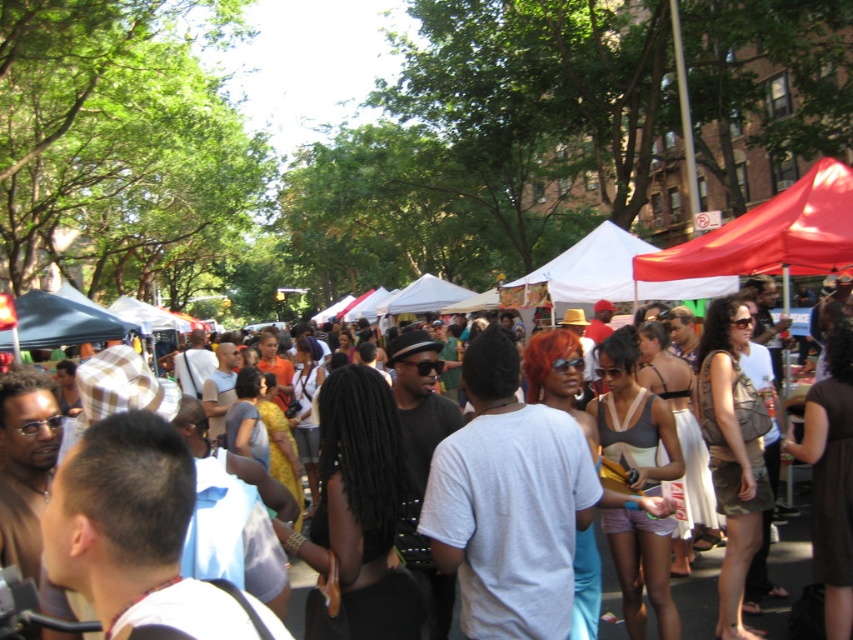
You are standing at the entrance of the market and want to locate the red fabric canopy at upper right. According to the coordinates provided, where exactly is it positioned?

The red fabric canopy at upper right is located at point [770,234] in the image.

You are standing at the center of the market and see a point marked at coordinates (770, 234). Which object in the scene does this point belong to?

The point at (770, 234) is on the red fabric canopy at upper right.

You are a vendor at the market and want to place a new stand between the red fabric canopy at upper right and the matte black hat at center. The stand requires 10 feet of space. Do you think there is enough space between them?

The red fabric canopy at upper right and matte black hat at center are 10.27 feet apart, so yes, there is enough space between them to place the stand as the distance is slightly more than the required 10 feet.